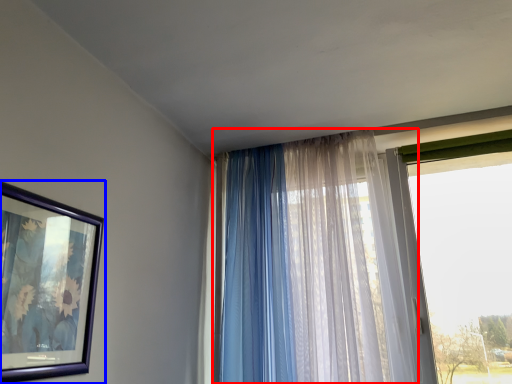
Question: Among these objects, which one is nearest to the camera, curtain (highlighted by a red box) or picture frame (highlighted by a blue box)?

Choices:
 (A) curtain
 (B) picture frame

Answer: (B)